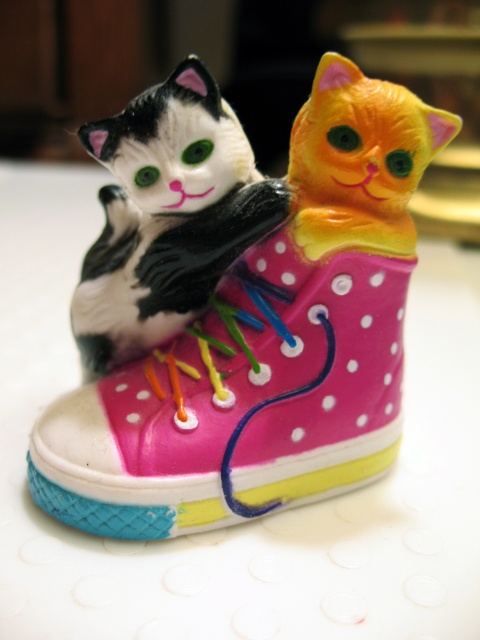
Is pink polka dot shoe at center bigger than matte black cat at center?

Correct, pink polka dot shoe at center is larger in size than matte black cat at center.

Is point (394, 250) positioned in front of point (109, 124)?

That is False.

Find the location of `pink polka dot shoe at center`. pink polka dot shoe at center is located at coordinates (266, 346).